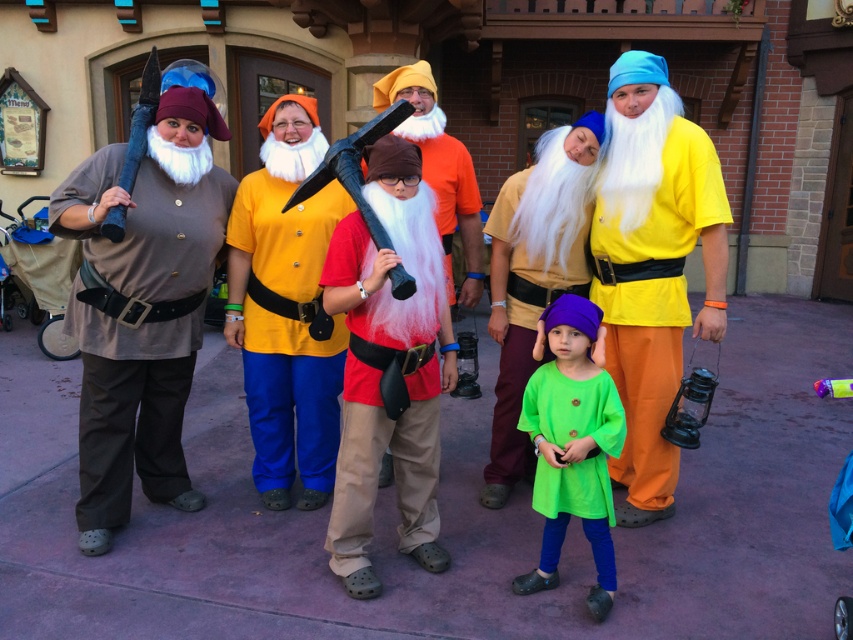
You are a photographer trying to capture a group photo of the people in the scene. You notice the red cotton shirt at center and the brown fabric shirt at left. Which person should you ask to move forward so that both shirts are visible in the photo?

You should ask the red cotton shirt at center to move forward because it is currently behind the brown fabric shirt at left, so moving it forward would ensure both are visible.

You are a costume designer observing the group of fantasy characters. You need to determine the spatial relationship between the purple felt hat at center and the matte red axe at center. Which object is positioned behind the other?

The matte red axe at center is behind the purple felt hat at center.

You are a costume designer assessing the group of people in the scene. You need to determine which costume has a narrower width between the red cotton shirt at center and the yellow matte shirt at center. Which one is narrower?

The red cotton shirt at center has a lesser width compared to the yellow matte shirt at center, so the red cotton shirt at center is narrower.